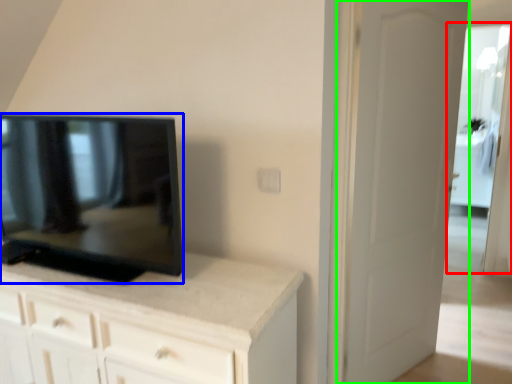
Question: Which object is positioned farthest from glass door (highlighted by a red box)? Select from television (highlighted by a blue box) and door (highlighted by a green box).

Choices:
 (A) television
 (B) door

Answer: (A)